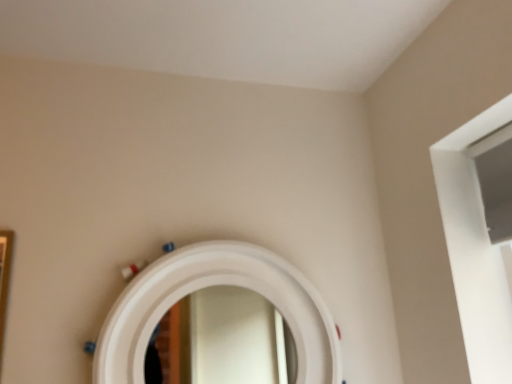
Question: Does white glossy mirror at center have a larger size compared to gold metallic picture frame at left?

Choices:
 (A) no
 (B) yes

Answer: (B)

Question: Does white glossy mirror at center have a smaller size compared to gold metallic picture frame at left?

Choices:
 (A) no
 (B) yes

Answer: (A)

Question: Is white glossy mirror at center at the left side of gold metallic picture frame at left?

Choices:
 (A) no
 (B) yes

Answer: (A)

Question: Is white glossy mirror at center positioned before gold metallic picture frame at left?

Choices:
 (A) no
 (B) yes

Answer: (A)

Question: Would you consider white glossy mirror at center to be distant from gold metallic picture frame at left?

Choices:
 (A) yes
 (B) no

Answer: (B)

Question: Is gold metallic picture frame at left a part of white glossy mirror at center?

Choices:
 (A) no
 (B) yes

Answer: (A)

Question: Does gold metallic picture frame at left have a larger size compared to white glossy mirror at center?

Choices:
 (A) no
 (B) yes

Answer: (A)

Question: Is gold metallic picture frame at left oriented away from white glossy mirror at center?

Choices:
 (A) no
 (B) yes

Answer: (A)

Question: Is the position of gold metallic picture frame at left more distant than that of white glossy mirror at center?

Choices:
 (A) yes
 (B) no

Answer: (B)

Question: Is gold metallic picture frame at left positioned in front of white glossy mirror at center?

Choices:
 (A) yes
 (B) no

Answer: (A)

Question: Considering the relative sizes of gold metallic picture frame at left and white glossy mirror at center in the image provided, is gold metallic picture frame at left taller than white glossy mirror at center?

Choices:
 (A) yes
 (B) no

Answer: (A)

Question: Is gold metallic picture frame at left facing towards white glossy mirror at center?

Choices:
 (A) no
 (B) yes

Answer: (A)

Question: Is white glossy mirror at center wider or thinner than gold metallic picture frame at left?

Choices:
 (A) wide
 (B) thin

Answer: (A)